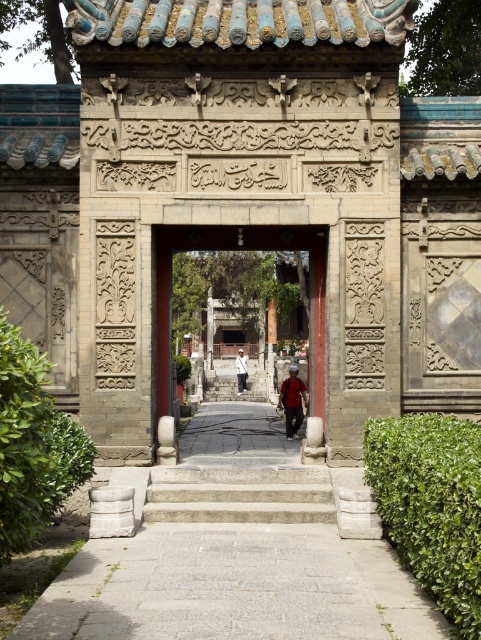
Question: Based on their relative distances, which object is farther from the green leafy hedge at right?

Choices:
 (A) smooth stone gate at center
 (B) green leafy hedge at lower left
 (C) gray stone stairs at center
 (D) red fabric backpack at center

Answer: (D)

Question: Can you confirm if gray stone stairs at center is smaller than red fabric backpack at center?

Choices:
 (A) no
 (B) yes

Answer: (B)

Question: Estimate the real-world distances between objects in this image. Which object is farther from the smooth stone gate at center?

Choices:
 (A) red fabric backpack at center
 (B) green leafy hedge at right

Answer: (A)

Question: Can you confirm if green leafy hedge at right is positioned to the right of smooth stone gate at center?

Choices:
 (A) yes
 (B) no

Answer: (A)

Question: Where is gray stone stairs at center located in relation to smooth stone gate at center in the image?

Choices:
 (A) left
 (B) right

Answer: (B)

Question: Which of the following is the farthest from the observer?

Choices:
 (A) green leafy hedge at right
 (B) red fabric backpack at center
 (C) green leafy hedge at lower left
 (D) white cotton shirt at center

Answer: (D)